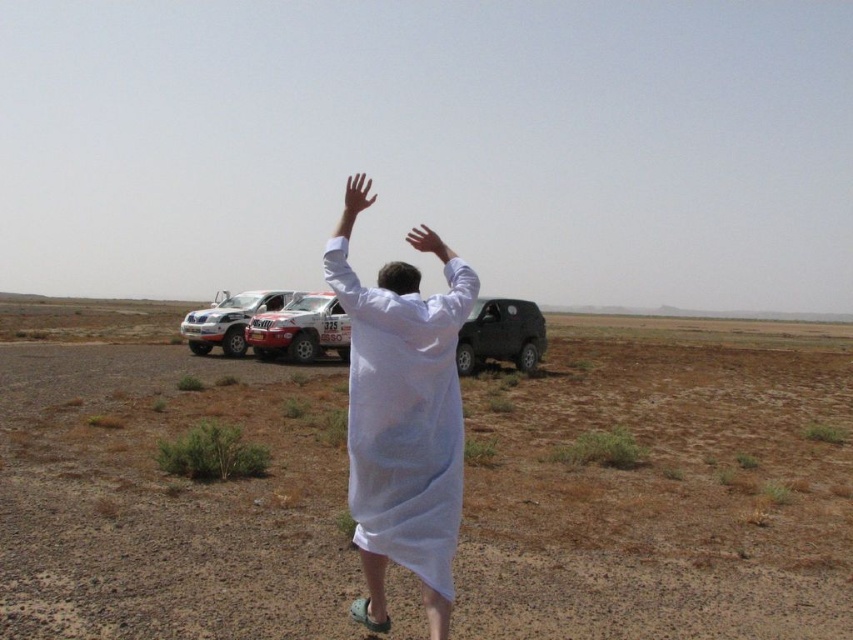
You are a photographer positioned at the point with coordinates (502, 336) in the desert scene. You want to capture a photo of the matte black SUV at center. Which direction should you face to ensure it is in the frame?

The point with coordinates (502, 336) corresponds to the matte black SUV at center, so you are already facing the matte black SUV at center. You should face forward to include it in your photo.

You are a photographer positioned at the point with coordinates (502, 336) in the desert scene. You want to capture a photo of the two white rally cars. Which direction should you move to ensure both cars are fully visible in your frame?

The point (502, 336) is located on the matte black SUV at center. To capture both white rally cars, you should move away from the matte black SUV at center towards the direction where the rally cars are parked, ensuring they are within your camera frame.